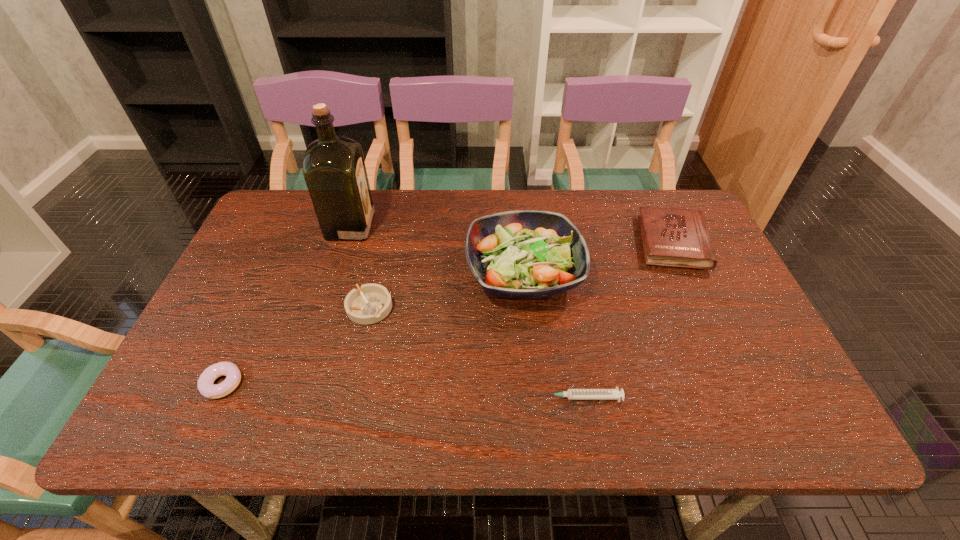
Locate an element on the screen. The image size is (960, 540). empty space that is in between the hardback book and the leftmost object is located at coordinates (447, 313).

You are a GUI agent. You are given a task and a screenshot of the screen. Output one action in this format:
    pyautogui.click(x=<x>, y=<y>)
    Task: Click on the free space between the hardback book and the shortest object
    
    Given the screenshot: What is the action you would take?
    pyautogui.click(x=627, y=320)

Find the location of a particular element. vacant area between the syringe and the doughnut is located at coordinates (401, 390).

Locate an element on the screen. Image resolution: width=960 pixels, height=540 pixels. vacant area that lies between the tallest object and the salad plate is located at coordinates (437, 249).

I want to click on vacant space in between the rightmost object and the shortest object, so click(x=627, y=320).

Locate an element on the screen. The height and width of the screenshot is (540, 960). free spot between the salad plate and the shortest object is located at coordinates (552, 335).

Where is `the second closest object to the salad plate`? The width and height of the screenshot is (960, 540). the second closest object to the salad plate is located at coordinates coord(370,303).

Identify which object is the second closest to the salad plate. Please provide its 2D coordinates. Your answer should be formatted as a tuple, i.e. [(x, y)], where the tuple contains the x and y coordinates of a point satisfying the conditions above.

[(370, 303)]

Image resolution: width=960 pixels, height=540 pixels. I want to click on free point that satisfies the following two spatial constraints: 1. on the label of the liquor; 2. on the back side of the ashtray, so click(x=324, y=308).

Where is `free location that satisfies the following two spatial constraints: 1. on the label of the rightmost object; 2. on the right side of the liquor`? Image resolution: width=960 pixels, height=540 pixels. free location that satisfies the following two spatial constraints: 1. on the label of the rightmost object; 2. on the right side of the liquor is located at coordinates (346, 243).